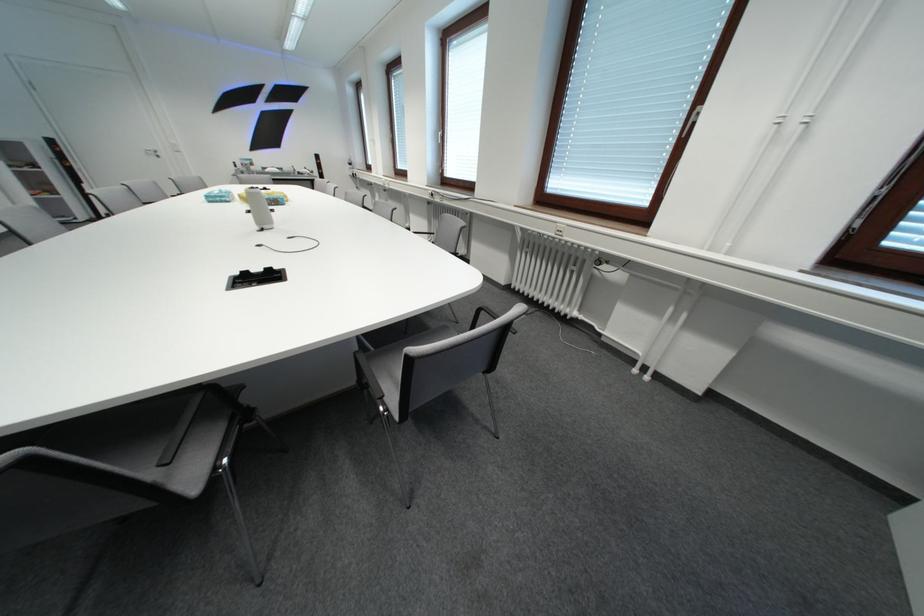
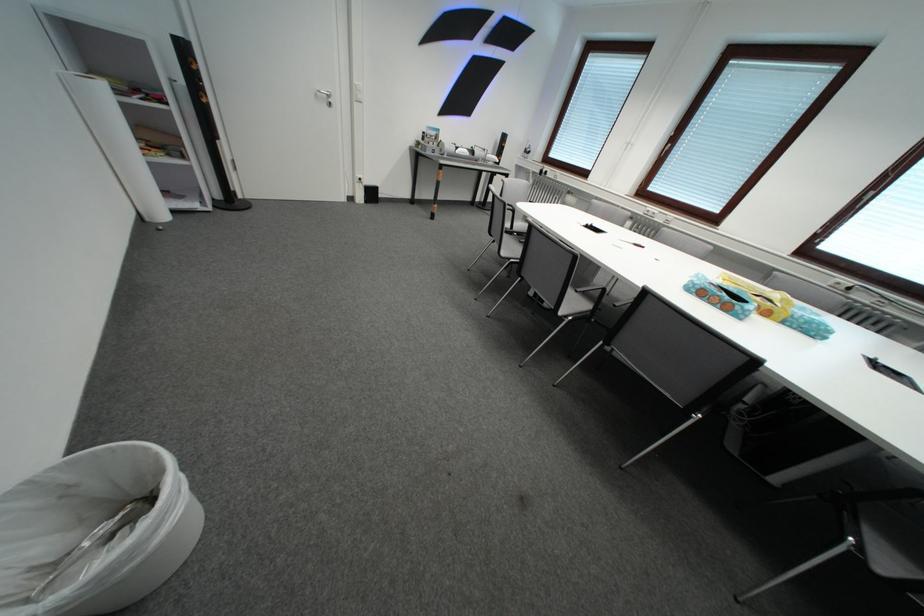
Question: I am providing you with two images of the same scene from different viewpoints. Please identify which objects are invisible in image2.

Choices:
 (A) tissue box
 (B) white paper roll
 (C) silver perfume bottle
 (D) white coffee mug

Answer: (A)